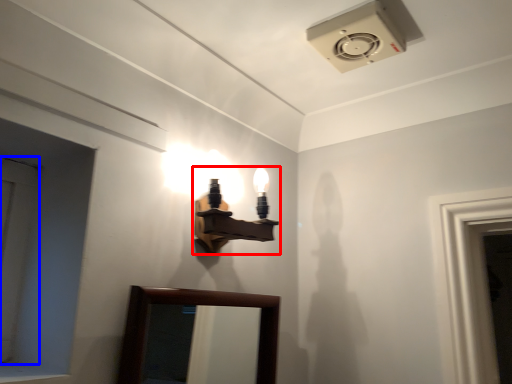
Question: Which point is further to the camera, lamp (highlighted by a red box) or door (highlighted by a blue box)?

Choices:
 (A) lamp
 (B) door

Answer: (A)